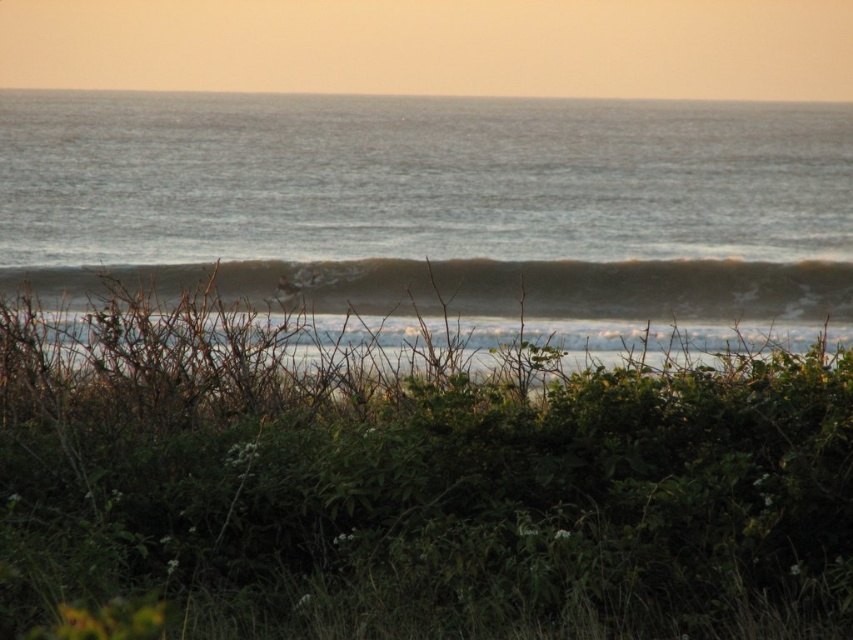
The width and height of the screenshot is (853, 640). Find the location of `blue water at center`. blue water at center is located at coordinates (436, 204).

Between blue water at center and white foam wave at center, which one appears on the left side from the viewer's perspective?

blue water at center is more to the left.

What do you see at coordinates (436, 204) in the screenshot?
I see `blue water at center` at bounding box center [436, 204].

Locate an element on the screen. blue water at center is located at coordinates (436, 204).

Can you confirm if green leafy bush at center is taller than blue water at center?

In fact, green leafy bush at center may be shorter than blue water at center.

Who is lower down, green leafy bush at center or blue water at center?

green leafy bush at center

You are a GUI agent. You are given a task and a screenshot of the screen. Output one action in this format:
    pyautogui.click(x=<x>, y=<y>)
    Task: Click on the green leafy bush at center
    The width and height of the screenshot is (853, 640).
    Given the screenshot: What is the action you would take?
    pyautogui.click(x=409, y=486)

Identify the location of green leafy bush at center. The height and width of the screenshot is (640, 853). (409, 486).

Is green leafy bush at center positioned at the back of white foam wave at center?

No.

Is green leafy bush at center to the left of white foam wave at center from the viewer's perspective?

Indeed, green leafy bush at center is positioned on the left side of white foam wave at center.

Measure the distance between point (717, 538) and camera.

Point (717, 538) and camera are 20.66 feet apart.

Locate an element on the screen. The width and height of the screenshot is (853, 640). green leafy bush at center is located at coordinates (409, 486).